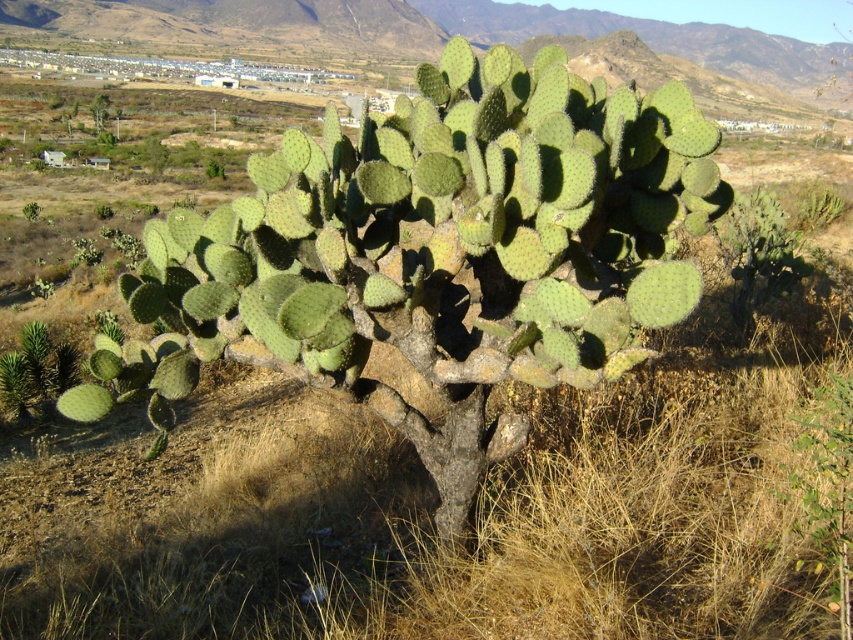
Does green spiny cactus at center appear over green spiny cactus at upper left?

No.

Can you confirm if green spiny cactus at center is taller than green spiny cactus at upper left?

No, green spiny cactus at center is not taller than green spiny cactus at upper left.

Between point (361, 205) and point (93, 109), which one is positioned behind?

Positioned behind is point (93, 109).

Where is `green spiny cactus at center`? The image size is (853, 640). green spiny cactus at center is located at coordinates (434, 253).